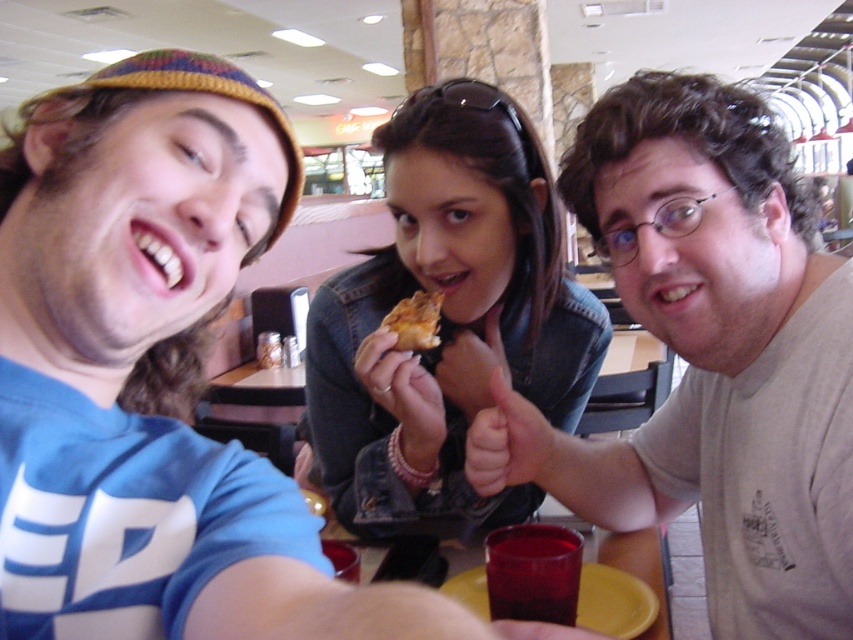
The image size is (853, 640). I want to click on matte gray t-shirt at center, so click(717, 353).

Who is more distant from viewer, (805,202) or (332,356)?

The point (332,356) is behind.

Image resolution: width=853 pixels, height=640 pixels. Find the location of `matte gray t-shirt at center`. matte gray t-shirt at center is located at coordinates (717, 353).

Which of these two, denim jacket at center or yellow plastic plate at lower center, stands shorter?

Standing shorter between the two is yellow plastic plate at lower center.

Between denim jacket at center and yellow plastic plate at lower center, which one is positioned higher?

denim jacket at center is above.

Which is in front, point (477, 220) or point (462, 561)?

Point (477, 220)

I want to click on denim jacket at center, so click(x=447, y=316).

Which is below, matte gray t-shirt at center or yellow plastic plate at lower center?

Positioned lower is yellow plastic plate at lower center.

Find the location of a particular element. Image resolution: width=853 pixels, height=640 pixels. matte gray t-shirt at center is located at coordinates (717, 353).